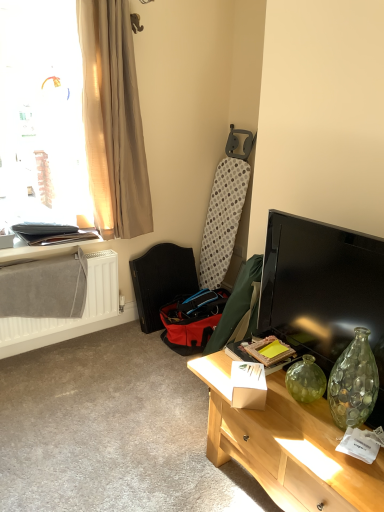
Question: Can you confirm if white textured radiator at left is thinner than matte black laptop at left?

Choices:
 (A) no
 (B) yes

Answer: (B)

Question: Is matte black laptop at left completely or partially inside white textured radiator at left?

Choices:
 (A) no
 (B) yes

Answer: (A)

Question: Can you confirm if white textured radiator at left is shorter than matte black laptop at left?

Choices:
 (A) no
 (B) yes

Answer: (A)

Question: From the image's perspective, is white textured radiator at left located above matte black laptop at left?

Choices:
 (A) yes
 (B) no

Answer: (B)

Question: Is white textured radiator at left aimed at matte black laptop at left?

Choices:
 (A) no
 (B) yes

Answer: (A)

Question: Is white textured radiator at left situated inside beige sheer curtain at upper left or outside?

Choices:
 (A) inside
 (B) outside

Answer: (B)

Question: From the image's perspective, relative to beige sheer curtain at upper left, is white textured radiator at left above or below?

Choices:
 (A) below
 (B) above

Answer: (A)

Question: In terms of width, does white textured radiator at left look wider or thinner when compared to beige sheer curtain at upper left?

Choices:
 (A) thin
 (B) wide

Answer: (A)

Question: Looking at the image, does white textured radiator at left seem bigger or smaller compared to beige sheer curtain at upper left?

Choices:
 (A) small
 (B) big

Answer: (A)

Question: Considering the positions of point (125, 233) and point (49, 243), is point (125, 233) closer or farther from the camera than point (49, 243)?

Choices:
 (A) farther
 (B) closer

Answer: (A)

Question: Based on their positions, is beige sheer curtain at upper left located to the left or right of matte black laptop at left?

Choices:
 (A) left
 (B) right

Answer: (B)

Question: Choose the correct answer: Is beige sheer curtain at upper left inside matte black laptop at left or outside it?

Choices:
 (A) inside
 (B) outside

Answer: (B)

Question: In the image, is beige sheer curtain at upper left positioned in front of or behind matte black laptop at left?

Choices:
 (A) behind
 (B) front

Answer: (B)

Question: Considering the relative positions of white cardboard box at center and light wood desk at lower right in the image provided, is white cardboard box at center to the left or to the right of light wood desk at lower right?

Choices:
 (A) right
 (B) left

Answer: (B)

Question: In the image, is white cardboard box at center positioned in front of or behind light wood desk at lower right?

Choices:
 (A) behind
 (B) front

Answer: (A)